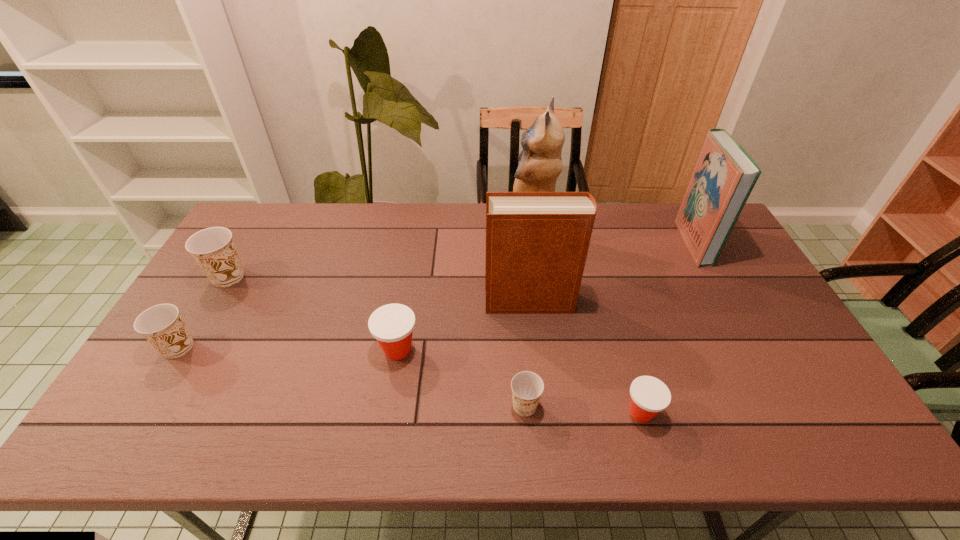
Find the location of `vacant space in between the second biggest orange Dixie cup and the left red-orange Dixie cup`. vacant space in between the second biggest orange Dixie cup and the left red-orange Dixie cup is located at coordinates (288, 349).

In order to click on free space between the second Dixie cup from right to left and the second nearest orange Dixie cup in this screenshot , I will do `click(351, 376)`.

I want to click on vacant area that lies between the biggest orange Dixie cup and the bigger red-orange Dixie cup, so click(x=313, y=313).

What are the coordinates of `object that ranks as the closest to the fourth tallest object` in the screenshot? It's located at (161, 325).

Point out which object is positioned as the seventh nearest to the sixth object from right to left. Please provide its 2D coordinates. Your answer should be formatted as a tuple, i.e. [(x, y)], where the tuple contains the x and y coordinates of a point satisfying the conditions above.

[(725, 174)]

Identify which Dixie cup is located as the second nearest to the third Dixie cup from left to right. Please provide its 2D coordinates. Your answer should be formatted as a tuple, i.e. [(x, y)], where the tuple contains the x and y coordinates of a point satisfying the conditions above.

[(213, 248)]

Find the location of a particular element. Dixie cup that stands as the second closest to the seventh object from left to right is located at coordinates (392, 325).

At what (x,y) coordinates should I click in order to perform the action: click on orange Dixie cup that is the second closest to the cat. Please return your answer as a coordinate pair (x, y). The width and height of the screenshot is (960, 540). Looking at the image, I should click on pyautogui.click(x=213, y=248).

Identify which orange Dixie cup is the closest to the tallest object. Please provide its 2D coordinates. Your answer should be formatted as a tuple, i.e. [(x, y)], where the tuple contains the x and y coordinates of a point satisfying the conditions above.

[(527, 387)]

Locate an element on the screen. vacant space that satisfies the following two spatial constraints: 1. on the front side of the rightmost Dixie cup; 2. on the left side of the left red-orange Dixie cup is located at coordinates (387, 413).